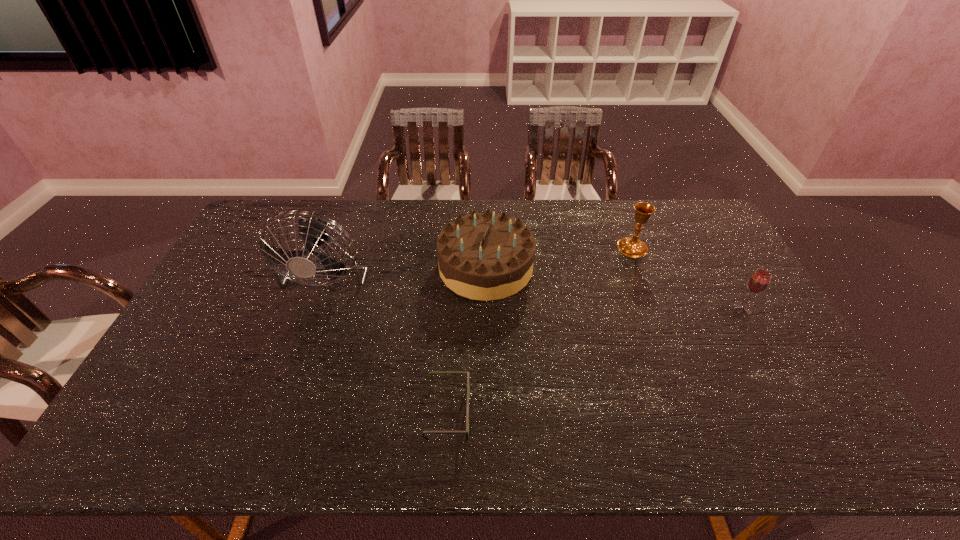
I want to click on vacant space located 0.340m on the front-facing side of the birthday cake, so click(x=335, y=267).

The height and width of the screenshot is (540, 960). Find the location of `free space located 0.080m on the front-facing side of the birthday cake`. free space located 0.080m on the front-facing side of the birthday cake is located at coordinates [x=414, y=267].

Locate an element on the screen. This screenshot has width=960, height=540. vacant position located 0.320m on the left of the rightmost object is located at coordinates (626, 309).

The width and height of the screenshot is (960, 540). Find the location of `vacant space located on the lens of the shortest object`. vacant space located on the lens of the shortest object is located at coordinates (535, 412).

Where is `fan located in the far edge section of the desktop`? fan located in the far edge section of the desktop is located at coordinates (313, 230).

Identify the location of chalice at the far edge. (632, 247).

Locate an element on the screen. birthday cake present at the far edge is located at coordinates (485, 256).

I want to click on object that is at the near edge, so click(x=468, y=373).

Where is `object situated at the right edge`? This screenshot has height=540, width=960. object situated at the right edge is located at coordinates (759, 281).

In the image, there is a desktop. Where is `vacant space at the far edge`? The image size is (960, 540). vacant space at the far edge is located at coordinates click(x=444, y=199).